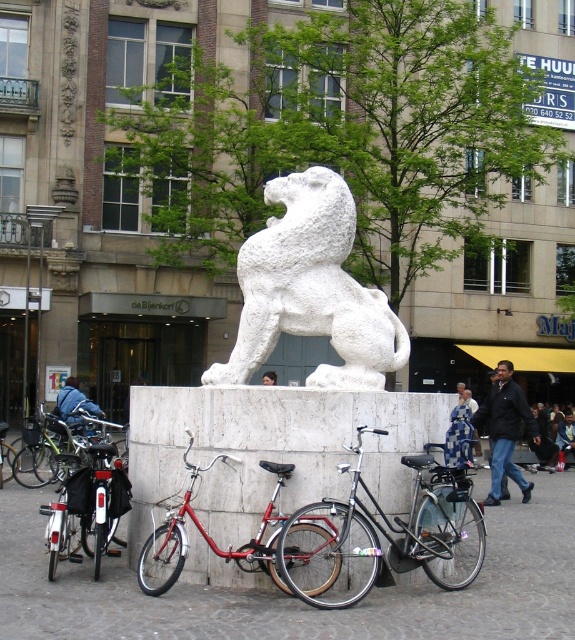
Question: Which of the following is the farthest from the observer?

Choices:
 (A) metallic red bicycle at center
 (B) shiny black bicycle at center
 (C) shiny black bicycle at lower left
 (D) white stone lion at center

Answer: (D)

Question: Can you confirm if white stone lion at center is wider than shiny black bicycle at center?

Choices:
 (A) yes
 (B) no

Answer: (B)

Question: Considering the relative positions of white stone lion at center and shiny black bicycle at center in the image provided, where is white stone lion at center located with respect to shiny black bicycle at center?

Choices:
 (A) below
 (B) above

Answer: (B)

Question: Which of the following is the closest to the observer?

Choices:
 (A) (98, 563)
 (B) (365, 376)
 (C) (423, 563)

Answer: (C)

Question: Can you confirm if metallic red bicycle at center is positioned above shiny black bicycle at lower left?

Choices:
 (A) yes
 (B) no

Answer: (A)

Question: Which of the following is the closest to the observer?

Choices:
 (A) (331, 282)
 (B) (270, 472)

Answer: (B)